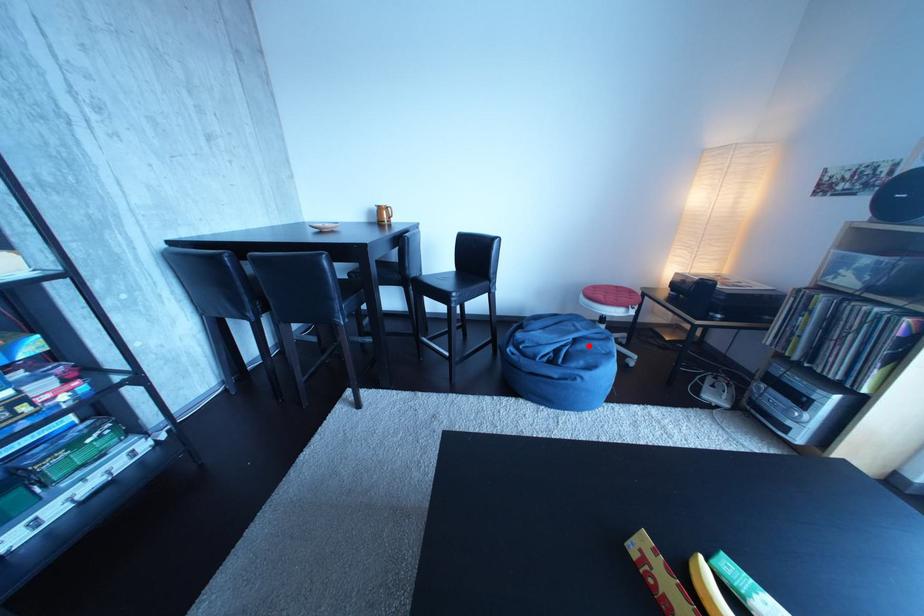
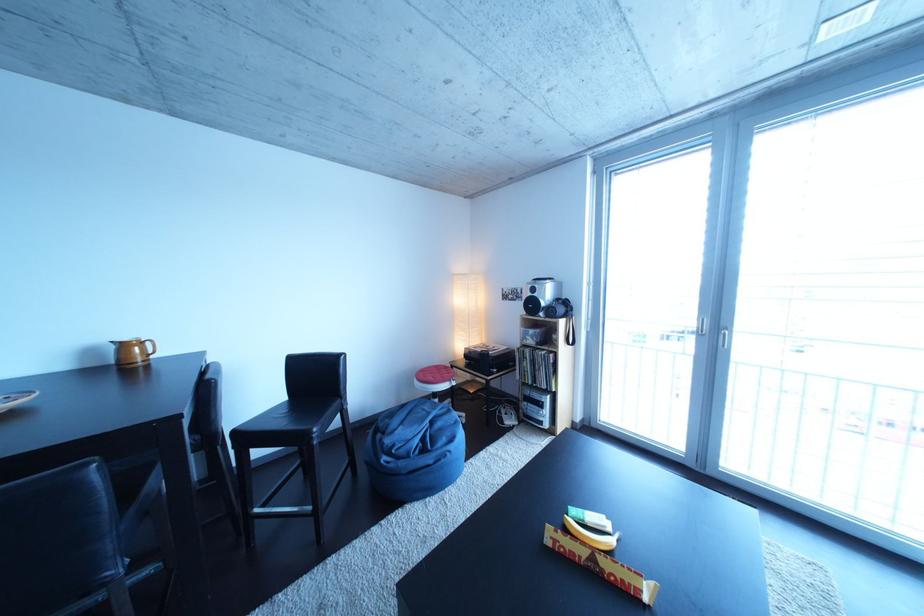
In the second image, find the point that corresponds to the highlighted location in the first image.

(444, 428)